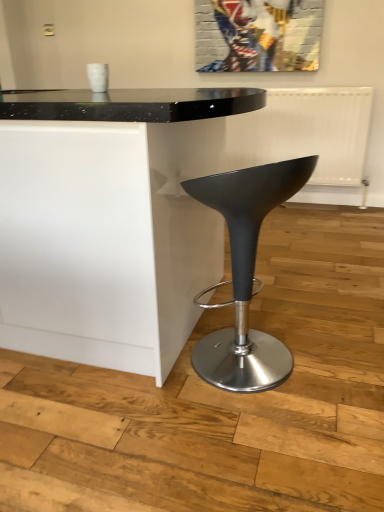
The height and width of the screenshot is (512, 384). I want to click on matte black stool at center, so click(x=245, y=274).

What do you see at coordinates (245, 274) in the screenshot? The width and height of the screenshot is (384, 512). I see `matte black stool at center` at bounding box center [245, 274].

I want to click on matte black stool at center, so click(x=245, y=274).